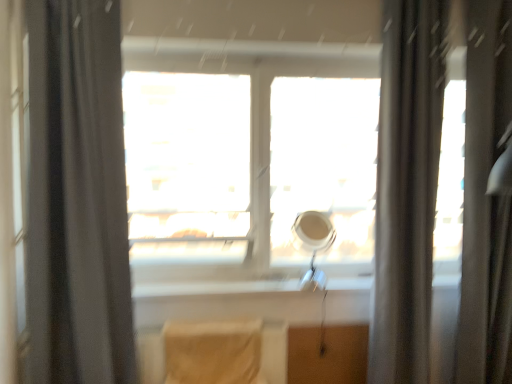
Question: Looking at their shapes, would you say silky gray shower curtain at right is wider or thinner than black fabric curtain at left, which is the 1th curtain in left-to-right order?

Choices:
 (A) wide
 (B) thin

Answer: (B)

Question: From the image's perspective, is silky gray shower curtain at right located above or below black fabric curtain at left, placed as the 2th curtain when sorted from right to left?

Choices:
 (A) below
 (B) above

Answer: (A)

Question: Which of these objects is positioned farthest from the black fabric curtain at left, placed as the 2th curtain when sorted from right to left?

Choices:
 (A) silky gray shower curtain at right
 (B) beige fabric chair at center
 (C) matte gray curtain at right, the 1th curtain when ordered from right to left
 (D) transparent glass window at center

Answer: (A)

Question: Estimate the real-world distances between objects in this image. Which object is farther from the silky gray shower curtain at right?

Choices:
 (A) matte gray curtain at right, the 1th curtain when ordered from right to left
 (B) beige fabric chair at center
 (C) black fabric curtain at left, placed as the 2th curtain when sorted from right to left
 (D) transparent glass window at center

Answer: (C)